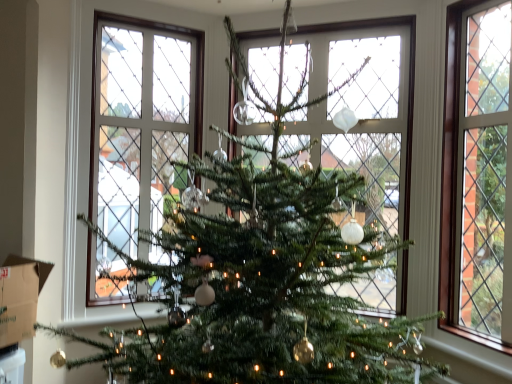
The height and width of the screenshot is (384, 512). What do you see at coordinates (476, 172) in the screenshot?
I see `clear glass window at right` at bounding box center [476, 172].

In order to click on clear glass window at right in this screenshot , I will do `click(476, 172)`.

The image size is (512, 384). What do you see at coordinates (20, 293) in the screenshot? I see `brown cardboard box at lower left` at bounding box center [20, 293].

At what (x,y) coordinates should I click in order to perform the action: click on brown cardboard box at lower left. Please return your answer as a coordinate pair (x, y). Looking at the image, I should click on (20, 293).

The height and width of the screenshot is (384, 512). In order to click on clear glass window at right in this screenshot , I will do `click(476, 172)`.

Is clear glass window at right to the left or to the right of brown cardboard box at lower left in the image?

Based on their positions, clear glass window at right is located to the right of brown cardboard box at lower left.

Between clear glass window at right and brown cardboard box at lower left, which one is positioned behind?

clear glass window at right is further away from the camera.

Considering the positions of point (457, 70) and point (10, 298), is point (457, 70) closer or farther from the camera than point (10, 298)?

Point (457, 70) is positioned farther from the camera compared to point (10, 298).

From the image's perspective, would you say clear glass window at right is positioned over brown cardboard box at lower left?

Correct, clear glass window at right appears higher than brown cardboard box at lower left in the image.

From a real-world perspective, is clear glass window at right on brown cardboard box at lower left?

Yes, from a real-world perspective, clear glass window at right is on top of brown cardboard box at lower left.

Does clear glass window at right have a lesser width compared to brown cardboard box at lower left?

Yes.

Is clear glass window at right shorter than brown cardboard box at lower left?

Incorrect, the height of clear glass window at right does not fall short of that of brown cardboard box at lower left.

Based on their sizes in the image, would you say clear glass window at right is bigger or smaller than brown cardboard box at lower left?

clear glass window at right is bigger than brown cardboard box at lower left.

Is clear glass window at right not within brown cardboard box at lower left?

Absolutely, clear glass window at right is external to brown cardboard box at lower left.

Is clear glass window at right not close to brown cardboard box at lower left?

Yes.

Is clear glass window at right oriented towards brown cardboard box at lower left?

No, clear glass window at right is not turned towards brown cardboard box at lower left.

How different are the orientations of clear glass window at right and brown cardboard box at lower left in degrees?

They differ by 128 degrees in their facing directions.

Image resolution: width=512 pixels, height=384 pixels. In the image, there is a clear glass window at right. In order to click on cardboard box below it (from a real-world perspective) in this screenshot , I will do `click(20, 293)`.

In the image, is brown cardboard box at lower left on the left side or the right side of clear glass window at right?

In the image, brown cardboard box at lower left appears on the left side of clear glass window at right.

Is brown cardboard box at lower left positioned behind clear glass window at right?

No, the depth of brown cardboard box at lower left is less than that of clear glass window at right.

Which is behind, point (0, 347) or point (462, 80)?

Point (462, 80)

From the image's perspective, which is below, brown cardboard box at lower left or clear glass window at right?

brown cardboard box at lower left appears lower in the image.

From a real-world perspective, which object stands above the other?

From a 3D spatial view, clear glass window at right is above.

Is brown cardboard box at lower left wider than clear glass window at right?

Correct, the width of brown cardboard box at lower left exceeds that of clear glass window at right.

Considering the sizes of brown cardboard box at lower left and clear glass window at right in the image, is brown cardboard box at lower left taller or shorter than clear glass window at right?

Considering their sizes, brown cardboard box at lower left has less height than clear glass window at right.

Is brown cardboard box at lower left bigger than clear glass window at right?

Incorrect, brown cardboard box at lower left is not larger than clear glass window at right.

Would you say brown cardboard box at lower left is outside clear glass window at right?

Yes.

Is brown cardboard box at lower left next to clear glass window at right?

No, brown cardboard box at lower left is not making contact with clear glass window at right.

Could you tell me if brown cardboard box at lower left is turned towards clear glass window at right?

No, brown cardboard box at lower left does not turn towards clear glass window at right.

How different are the orientations of brown cardboard box at lower left and clear glass window at right in degrees?

128 degrees.

Measure the distance from brown cardboard box at lower left to clear glass window at right.

1.97 meters.

Locate an element on the screen. window above the brown cardboard box at lower left (from a real-world perspective) is located at coordinates (476, 172).

I want to click on window on the right of the brown cardboard box at lower left, so click(476, 172).

Find the location of a particular element. cardboard box in front of the clear glass window at right is located at coordinates (20, 293).